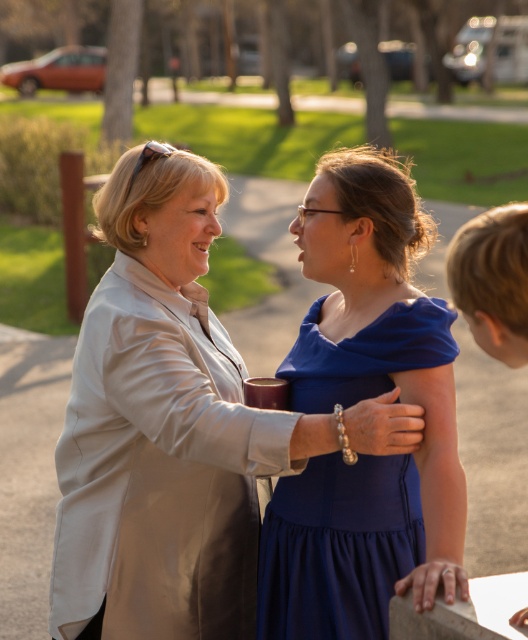
Consider the image. You are a fashion designer observing two women in the image. You need to determine which clothing item requires more fabric to make between the satin beige blazer at center and the royal blue satin dress at center. Which one would need more fabric?

The satin beige blazer at center is bigger than the royal blue satin dress at center, so it would require more fabric to make.

You are a fashion designer observing two outfits in the image. The first is the satin beige blazer at center, and the second is the royal blue satin dress at center. Which of these two outfits is taller in height?

The satin beige blazer at center is taller in height compared to the royal blue satin dress at center.

What is located at the coordinates point (163, 429)?

The satin beige blazer at center is located at point (163, 429).